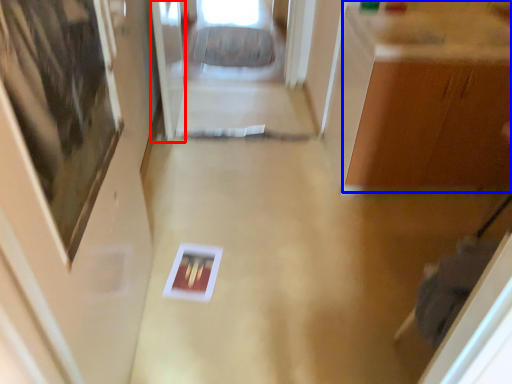
Question: Which object appears farthest to the camera in this image, glass door (highlighted by a red box) or cabinetry (highlighted by a blue box)?

Choices:
 (A) glass door
 (B) cabinetry

Answer: (A)